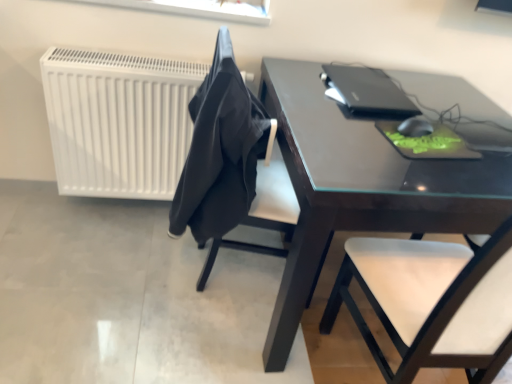
Locate an element on the screen. free spot to the right of black matte mouse at upper right is located at coordinates (476, 139).